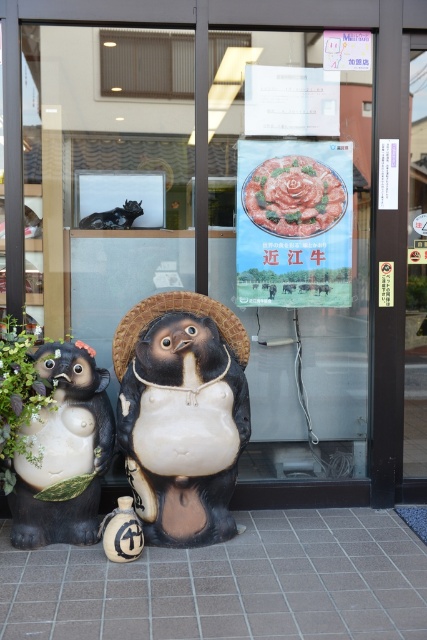
You are a delivery person who needs to place a new rectangular box that is 1.2 meters wide between the matte ceramic penguin at center and the matte black bear at left. Based on the scene, will the space between them be wide enough to fit the box?

The matte ceramic penguin at center is wider than the matte black bear at left. However, the question is about the space between them, not their individual widths. The provided information does not specify the distance between the two objects, so it cannot be determined if the 1.2 meter box will fit.

You are a customer standing at the entrance of the shop and want to take a photo of the matte ceramic penguin at center and the brown woven straw hat at center. Which object should you focus on first if you want both to be in sharp focus?

The matte ceramic penguin at center is closer to the viewer than the brown woven straw hat at center. To have both in sharp focus, focus on the matte ceramic penguin at center since it is the closer object.